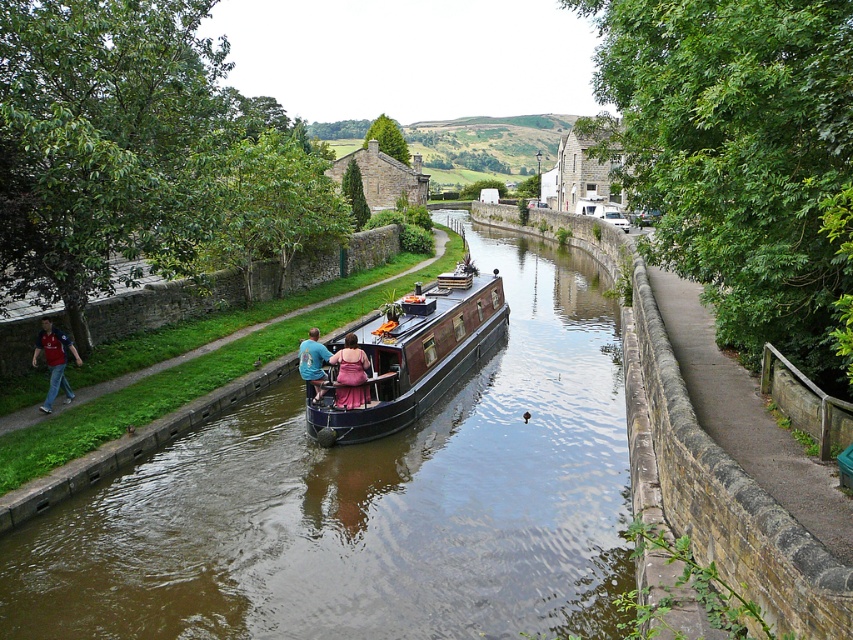
Question: Based on their relative distances, which object is nearer to the rustic wood boat at center?

Choices:
 (A) brown wooden boat at center
 (B) stone paved path at right
 (C) matte red shirt at left

Answer: (A)

Question: Which object appears closest to the camera in this image?

Choices:
 (A) brown wooden boat at center
 (B) rustic wood boat at center
 (C) matte red shirt at left
 (D) blue cotton shirt at center

Answer: (A)

Question: Does stone paved path at right come in front of rustic wood boat at center?

Choices:
 (A) no
 (B) yes

Answer: (B)

Question: Is stone paved path at right to the left of rustic wood boat at center from the viewer's perspective?

Choices:
 (A) no
 (B) yes

Answer: (A)

Question: Which point appears farthest from the camera in this image?

Choices:
 (A) (309, 330)
 (B) (363, 388)
 (C) (439, 586)

Answer: (A)

Question: Is brown wooden boat at center closer to the viewer compared to stone paved path at right?

Choices:
 (A) no
 (B) yes

Answer: (A)